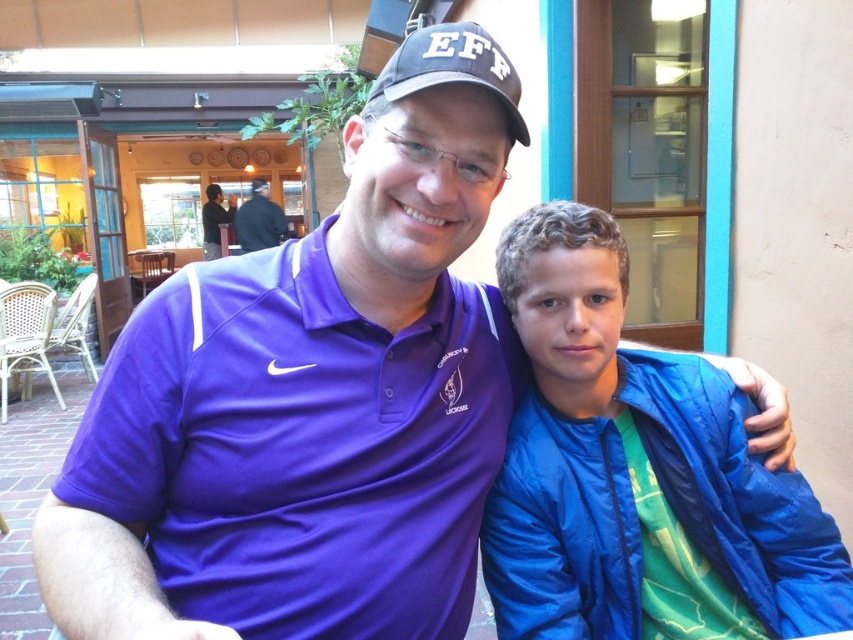
You are a photographer setting up for a group photo. You need to ensure that all clothing items in the frame are visible. Given that the purple polyester polo shirt at center and the blue nylon jacket at right are part of the composition, which clothing item might require more space in the frame to avoid being cropped out?

The purple polyester polo shirt at center requires more space in the frame because its width surpasses that of the blue nylon jacket at right, so it is wider and might need extra room to ensure full visibility.

You are a photographer trying to capture a group photo of the blue nylon jacket at right and the black fabric shirt at upper center. Since you want to ensure both are clearly visible, which object should you focus on to avoid blurring due to their size differences?

The blue nylon jacket at right occupies less space than the black fabric shirt at upper center, so you should focus on the black fabric shirt at upper center to ensure clarity since it takes up more of the frame.